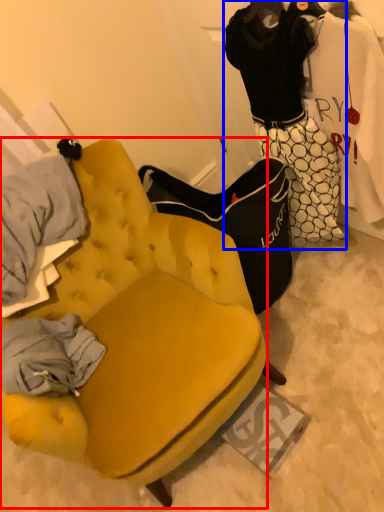
Question: Which of the following is the farthest to the observer, chair (highlighted by a red box) or couple (highlighted by a blue box)?

Choices:
 (A) chair
 (B) couple

Answer: (B)